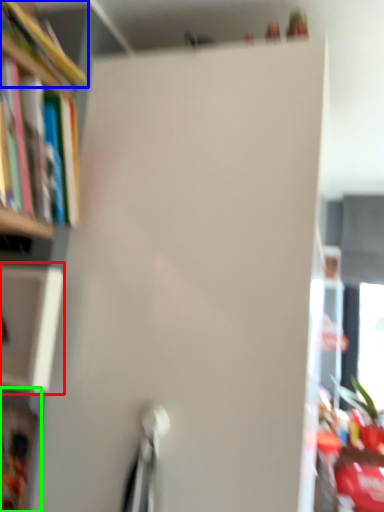
Question: Considering the real-world distances, which object is closest to cabinet (highlighted by a red box)? book (highlighted by a blue box) or cabinet (highlighted by a green box).

Choices:
 (A) book
 (B) cabinet

Answer: (B)